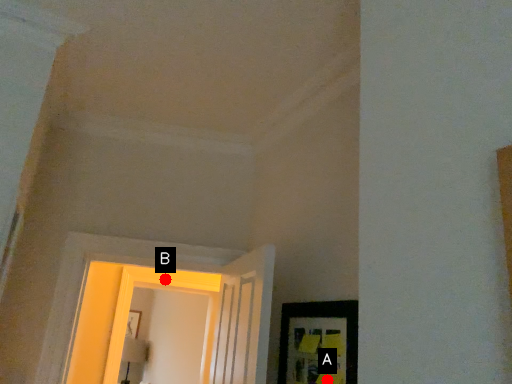
Question: Two points are circled on the image, labeled by A and B beside each circle. Which point is farther from the camera taking this photo?

Choices:
 (A) A is further
 (B) B is further

Answer: (B)